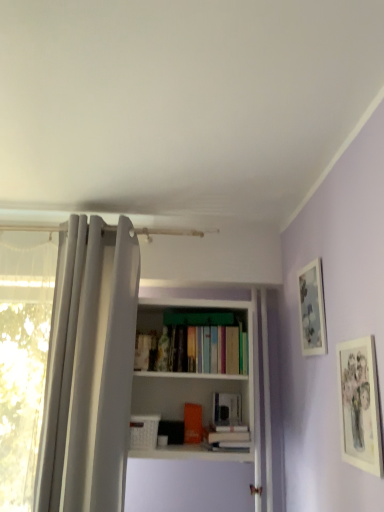
Question: Which is correct: matte paper picture frame at right, the first picture frame viewed from the front, is inside white matte bookshelf at center, or outside of it?

Choices:
 (A) outside
 (B) inside

Answer: (A)

Question: Is matte paper picture frame at right, which is counted as the second picture frame, starting from the back, to the left or to the right of white matte bookshelf at center in the image?

Choices:
 (A) left
 (B) right

Answer: (B)

Question: Estimate the real-world distances between objects in this image. Which object is closer to the orange matte bookshelf at center, the 2th book positioned from the right?

Choices:
 (A) white fabric shower curtain at left
 (B) matte paper picture frame at right, the first picture frame viewed from the front
 (C) white matte bookshelf at center
 (D) matte silver picture frame at upper right, the second picture frame when ordered from front to back
 (E) hardcover book at center, marked as the 2th book in a left-to-right arrangement

Answer: (E)

Question: Based on their relative distances, which object is farther from the matte paper picture frame at right, which is counted as the second picture frame, starting from the back?

Choices:
 (A) matte silver picture frame at upper right, the second picture frame when ordered from front to back
 (B) white fabric shower curtain at left
 (C) white matte bookshelf at center
 (D) hardcover book at center, placed as the 1th book when sorted from right to left
 (E) orange matte bookshelf at center, which is counted as the 1th book, starting from the left

Answer: (B)